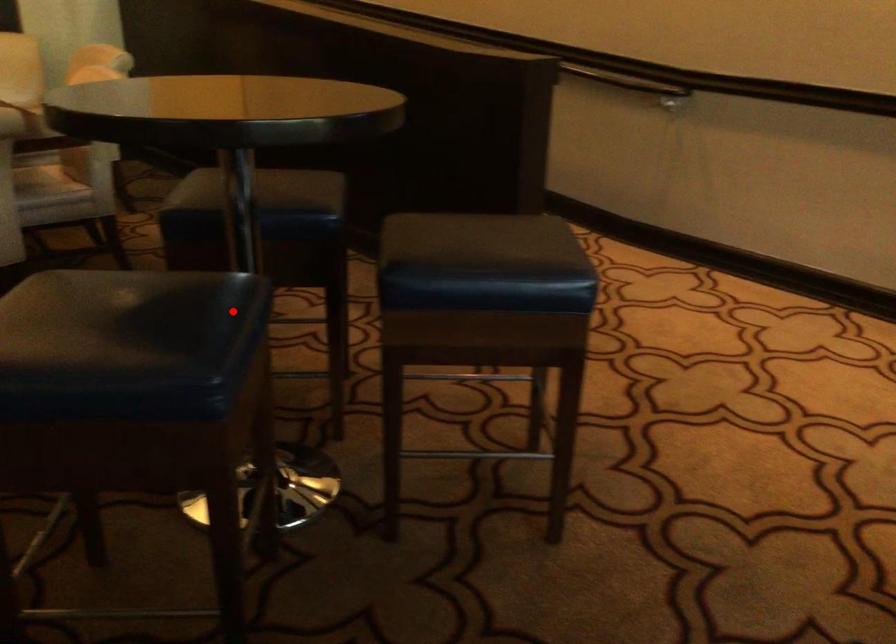
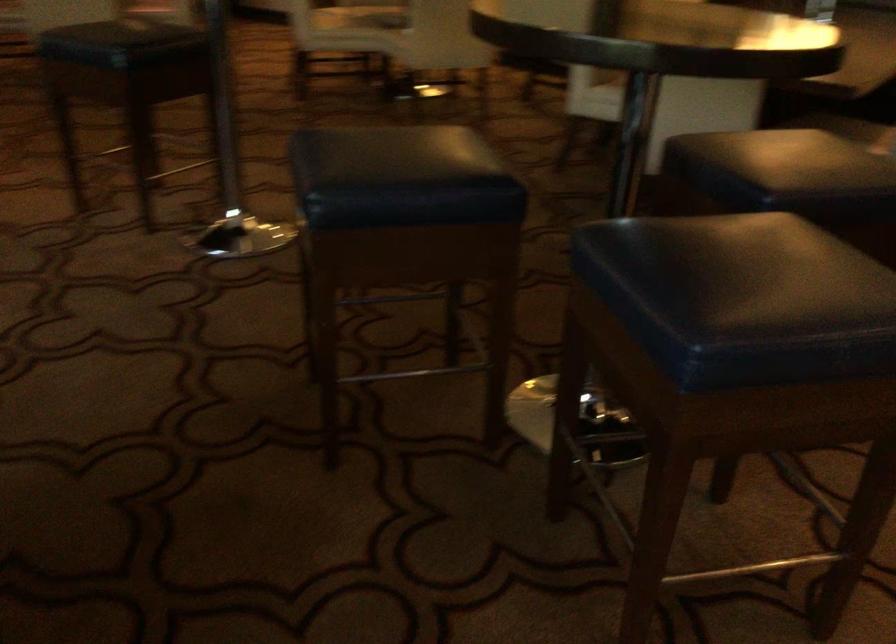
Question: I am providing you with two images of the same scene from different viewpoints. Image1 has a red point marked. In image2, the corresponding 3D location appears at what relative position? Reply with the corresponding letter.

Choices:
 (A) Closer
 (B) Farther

Answer: (B)